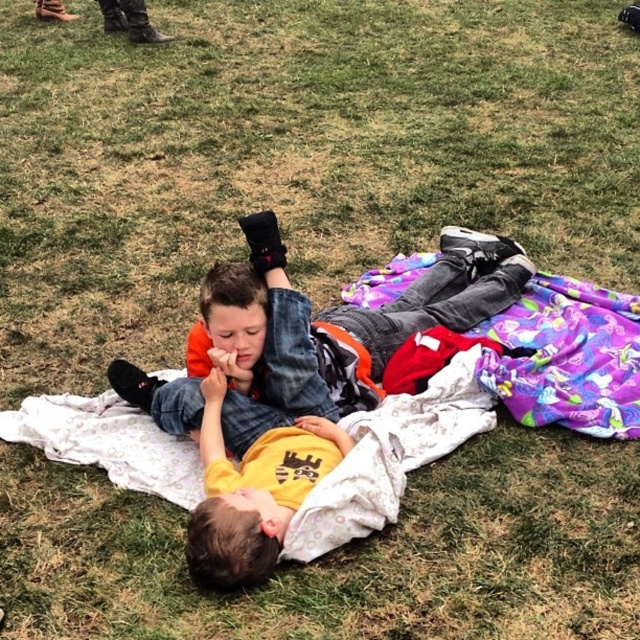
Is point (524, 284) closer to camera compared to point (525, 387)?

No, it is behind (525, 387).

Is the position of orange fleece jacket at center more distant than that of purple fabric blanket at center?

That is False.

Does point (476, 316) come behind point (360, 304)?

No, it is not.

At what (x,y) coordinates should I click in order to perform the action: click on orange fleece jacket at center. Please return your answer as a coordinate pair (x, y). The height and width of the screenshot is (640, 640). Looking at the image, I should click on (314, 333).

Can you confirm if purple fleece blanket at center is smaller than orange fleece jacket at center?

Indeed, purple fleece blanket at center has a smaller size compared to orange fleece jacket at center.

Is purple fleece blanket at center below orange fleece jacket at center?

Indeed, purple fleece blanket at center is positioned under orange fleece jacket at center.

Locate an element on the screen. This screenshot has height=640, width=640. purple fleece blanket at center is located at coordinates (522, 381).

Which of these two, purple fleece blanket at center or purple fabric blanket at center, stands shorter?

purple fabric blanket at center

Who is more distant from viewer, (x=540, y=316) or (x=540, y=381)?

Positioned behind is point (x=540, y=316).

Find the location of `purple fleece blanket at center`. purple fleece blanket at center is located at coordinates (522, 381).

Find the location of `purple fleece blanket at center`. purple fleece blanket at center is located at coordinates (522, 381).